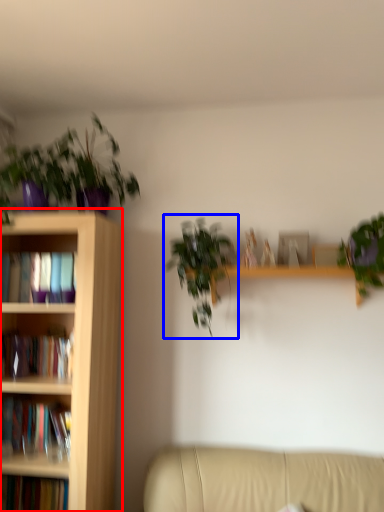
Question: Which of the following is the closest to the observer, bookcase (highlighted by a red box) or houseplant (highlighted by a blue box)?

Choices:
 (A) bookcase
 (B) houseplant

Answer: (A)